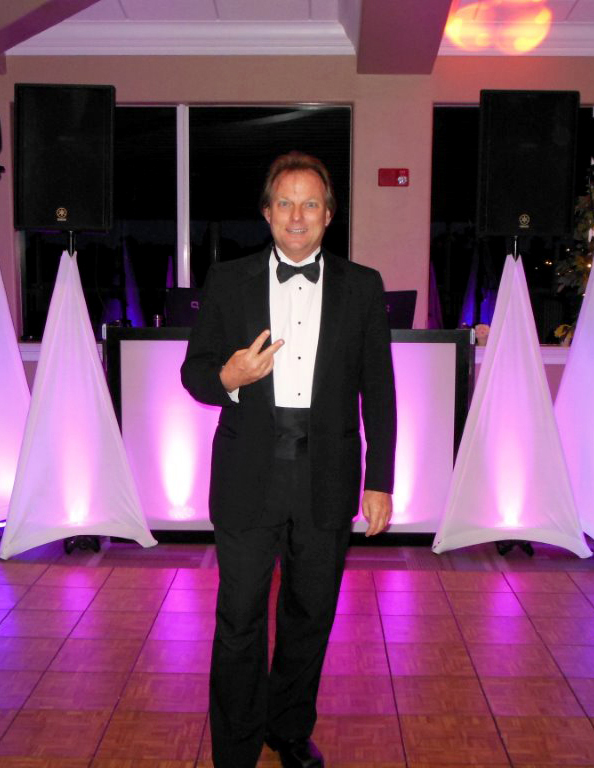
Where is `reflection of light on the wall`? The height and width of the screenshot is (768, 594). reflection of light on the wall is located at coordinates (497, 31).